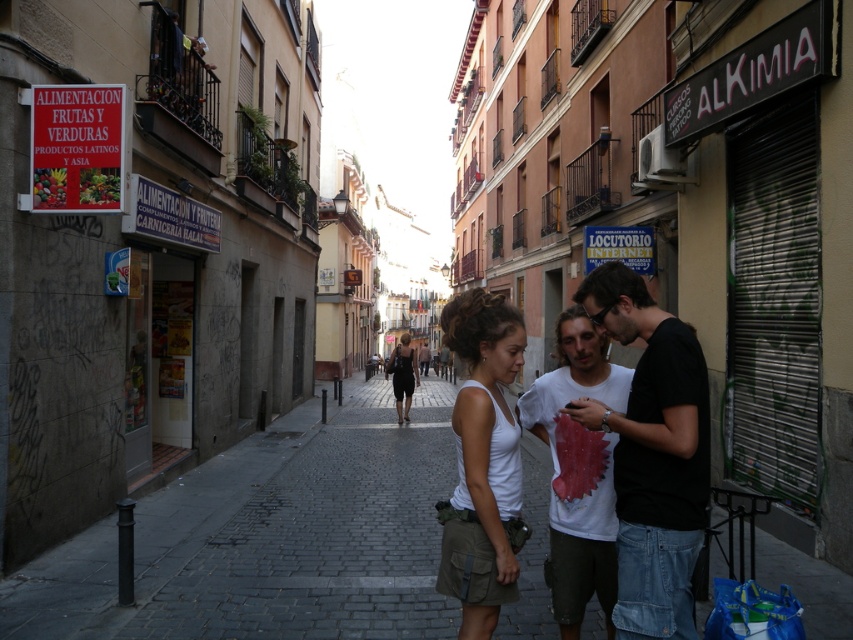
Question: Can you confirm if white cotton t-shirt at center is positioned above black satin dress at center?

Choices:
 (A) no
 (B) yes

Answer: (B)

Question: Among these objects, which one is nearest to the camera?

Choices:
 (A) black satin dress at center
 (B) white cotton tank top at center
 (C) black matte shirt at center
 (D) white cotton t-shirt at center

Answer: (C)

Question: Where is black matte shirt at center located in relation to black satin dress at center in the image?

Choices:
 (A) below
 (B) above

Answer: (B)

Question: Which of the following is the closest to the observer?

Choices:
 (A) white cotton tank top at center
 (B) black matte shirt at center
 (C) white cotton t-shirt at center

Answer: (B)

Question: Is black matte shirt at center wider than black satin dress at center?

Choices:
 (A) no
 (B) yes

Answer: (A)

Question: Which object is closer to the camera taking this photo?

Choices:
 (A) black matte shirt at center
 (B) black satin dress at center
 (C) dark gray cobblestone at center
 (D) white cotton t-shirt at center

Answer: (A)